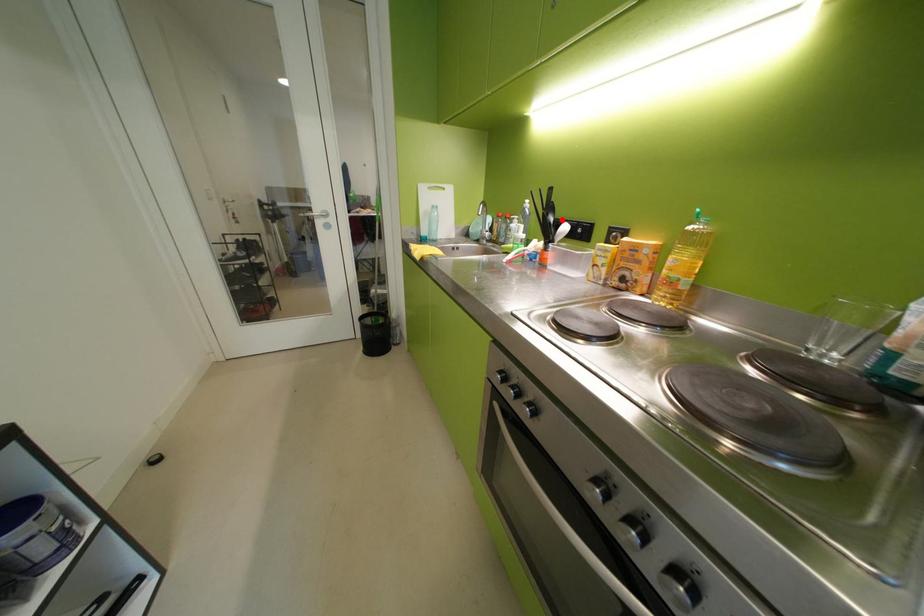
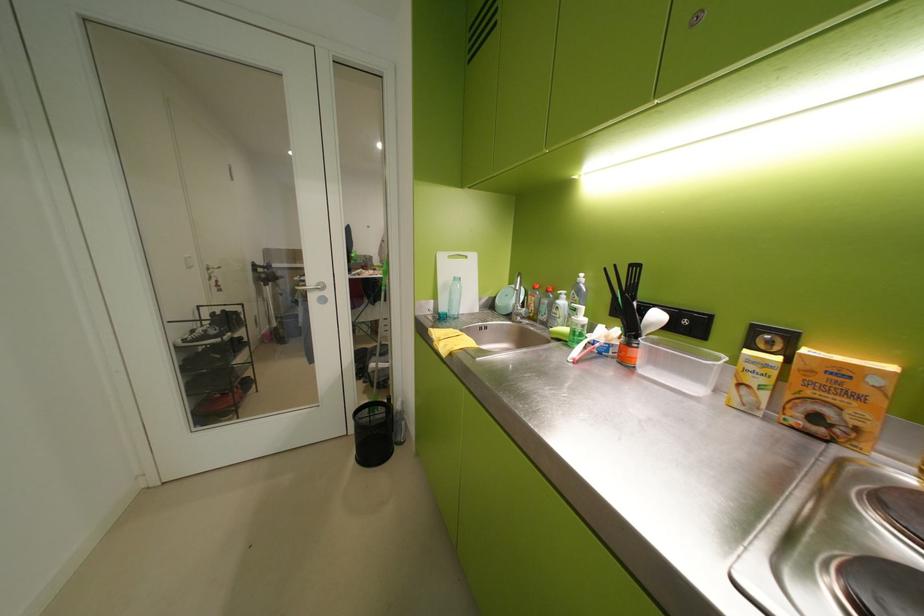
In the second image, find the point that corresponds to the highlighted location in the first image.

(646, 304)